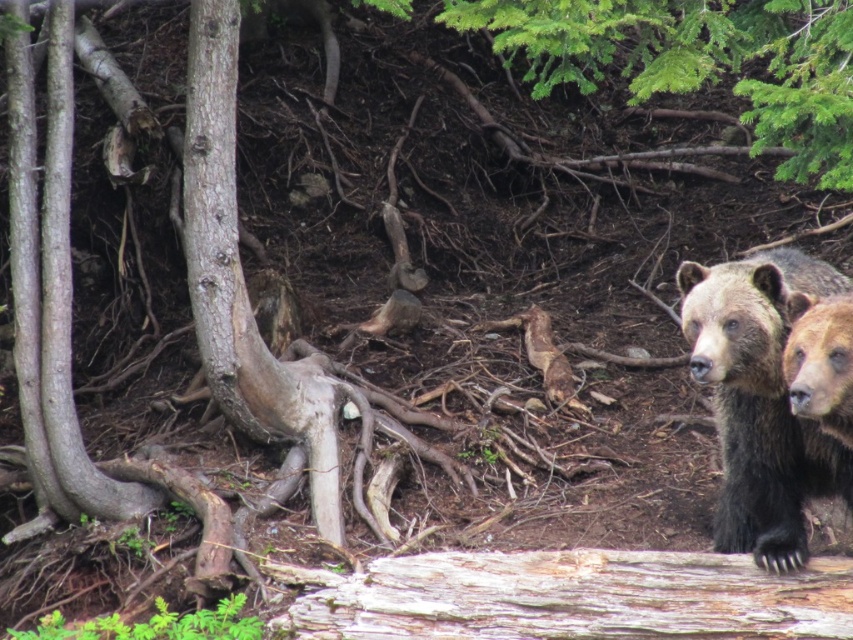
You are a hiker trying to navigate through the forest. You see a brown fur bear at right and a smooth brown bark at center. Which object is lower in the image?

The brown fur bear at right is below the smooth brown bark at center, so the brown fur bear at right is lower in the image.

You are standing at the center of the forest scene and need to locate the weathered wood at lower right. Based on its coordinates, is it closer to the bottom or the right edge of the image?

The weathered wood at lower right is located at point 0.934 on the x and 0.671 on the y. Since both coordinates are closer to 1, it is closer to both the right and bottom edges, but since the question specifies either bottom or right, it is closer to the right edge as 0.934 is further from 0 than 0.671 from 0 in their respective axes.